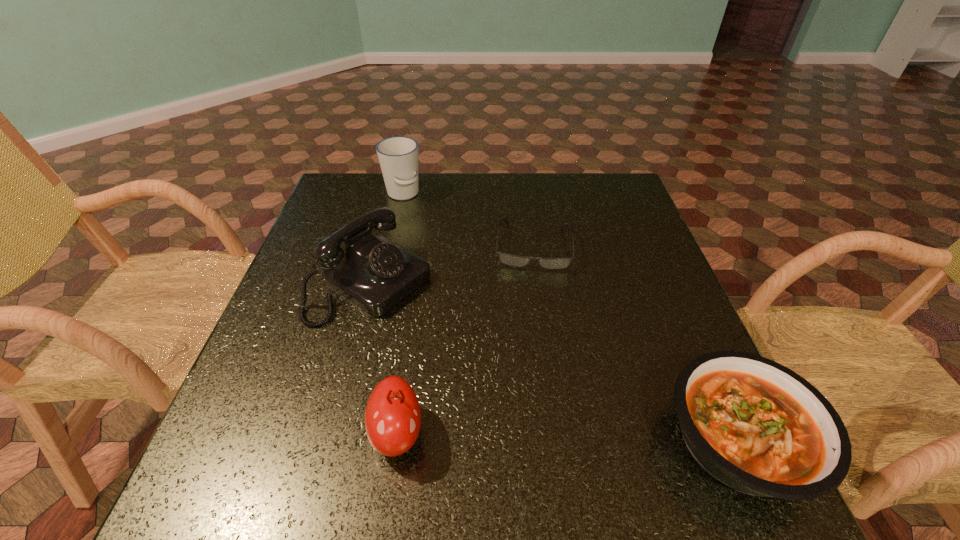
Identify the location of apple. Image resolution: width=960 pixels, height=540 pixels. (393, 417).

The image size is (960, 540). I want to click on stew, so click(x=756, y=426).

Where is `the rightmost object`? The width and height of the screenshot is (960, 540). the rightmost object is located at coordinates (756, 426).

The width and height of the screenshot is (960, 540). What are the coordinates of `cup` in the screenshot? It's located at (398, 156).

This screenshot has width=960, height=540. In order to click on spectacles in this screenshot , I will do `click(514, 260)`.

The image size is (960, 540). Identify the location of the fourth object from left to right. (514, 260).

Locate an element on the screen. Image resolution: width=960 pixels, height=540 pixels. telephone is located at coordinates (373, 273).

Locate an element on the screen. Image resolution: width=960 pixels, height=540 pixels. vacant space located on the stem of the apple is located at coordinates (627, 434).

Where is `free space located on the back of the stew`? This screenshot has height=540, width=960. free space located on the back of the stew is located at coordinates (660, 267).

Identify the location of free space located 0.310m with a handle on the side of the cup. The width and height of the screenshot is (960, 540). point(440,273).